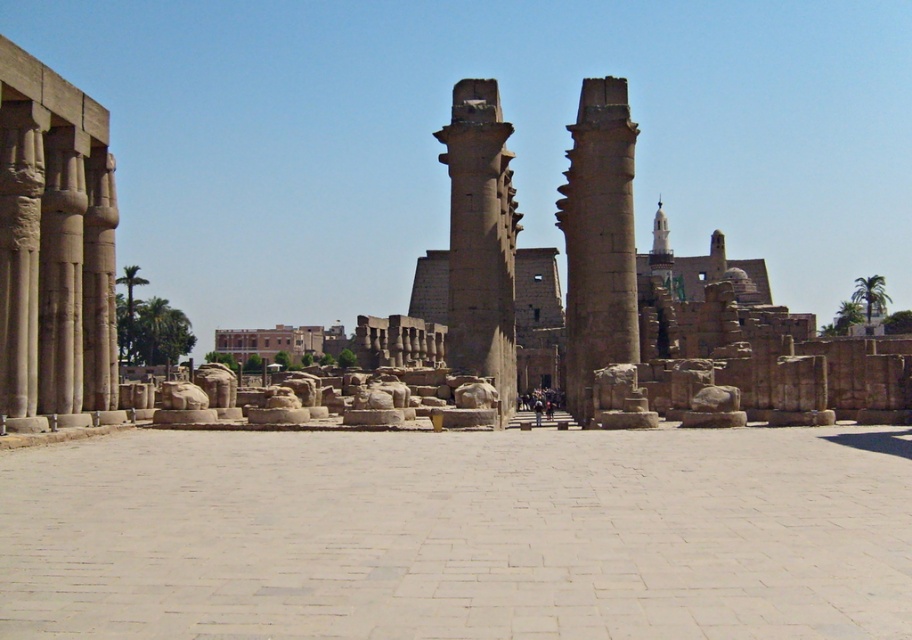
You are an archaeologist standing at point (318, 500) in the temple complex. You need to reach a hidden artifact located at point 0.350, 0.783. Given that the distance between these two points is 45.92 meters, can you estimate how far you need to walk to reach the artifact?

The distance between point (318, 500) and point 0.350, 0.783 is 45.92 meters, so you need to walk approximately 45.92 meters to reach the artifact.

You are an archaeologist examining the ancient Egyptian temple complex. You notice two columns in the scene, the smooth stone columns at left and the smooth stone column at center. Which of these has a greater width?

The smooth stone column at center has a greater width than the smooth stone columns at left according to the description.